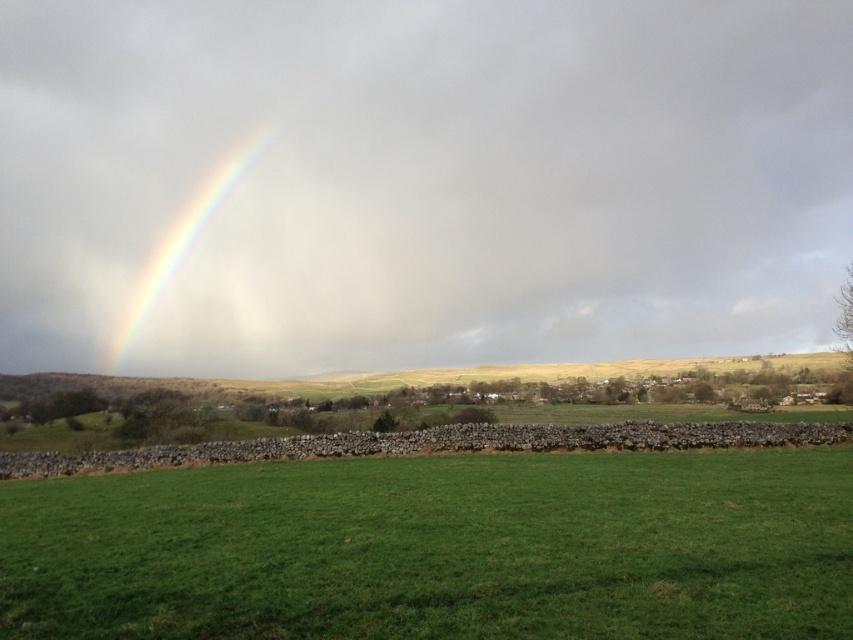
Question: Can you confirm if green grass at center is positioned below rainbow at upper left?

Choices:
 (A) yes
 (B) no

Answer: (A)

Question: Which object is closer to the camera taking this photo?

Choices:
 (A) green grass at center
 (B) rainbow at upper left

Answer: (A)

Question: Can you confirm if green grass at center is smaller than rainbow at upper left?

Choices:
 (A) yes
 (B) no

Answer: (A)

Question: Among these points, which one is nearest to the camera?

Choices:
 (A) (723, 540)
 (B) (161, 272)

Answer: (A)

Question: Can you confirm if green grass at center is smaller than rainbow at upper left?

Choices:
 (A) yes
 (B) no

Answer: (A)

Question: Among these points, which one is farthest from the camera?

Choices:
 (A) (840, 604)
 (B) (241, 177)

Answer: (B)